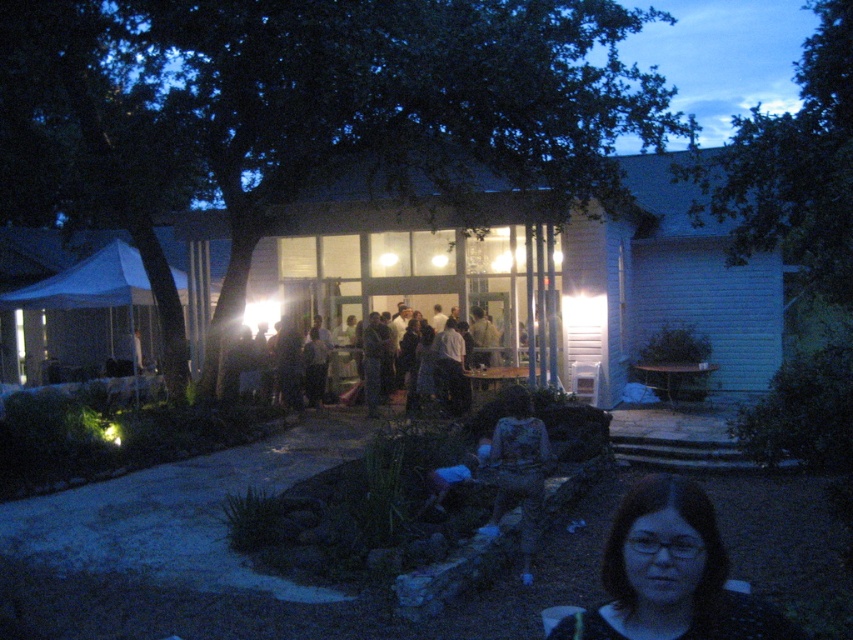
Question: Does camouflage fabric shirt at center have a larger size compared to dark clothing at center?

Choices:
 (A) yes
 (B) no

Answer: (B)

Question: Which object is closer to the camera taking this photo?

Choices:
 (A) camouflage fabric shirt at center
 (B) brown hair at lower right

Answer: (B)

Question: Which point is closer to the camera?

Choices:
 (A) brown hair at lower right
 (B) camouflage fabric shirt at center

Answer: (A)

Question: Does brown hair at lower right appear under camouflage fabric shirt at center?

Choices:
 (A) yes
 (B) no

Answer: (B)

Question: Does camouflage fabric shirt at center have a larger size compared to dark clothing at center?

Choices:
 (A) yes
 (B) no

Answer: (B)

Question: Estimate the real-world distances between objects in this image. Which object is farther from the brown hair at lower right?

Choices:
 (A) camouflage fabric shirt at center
 (B) dark clothing at center

Answer: (B)